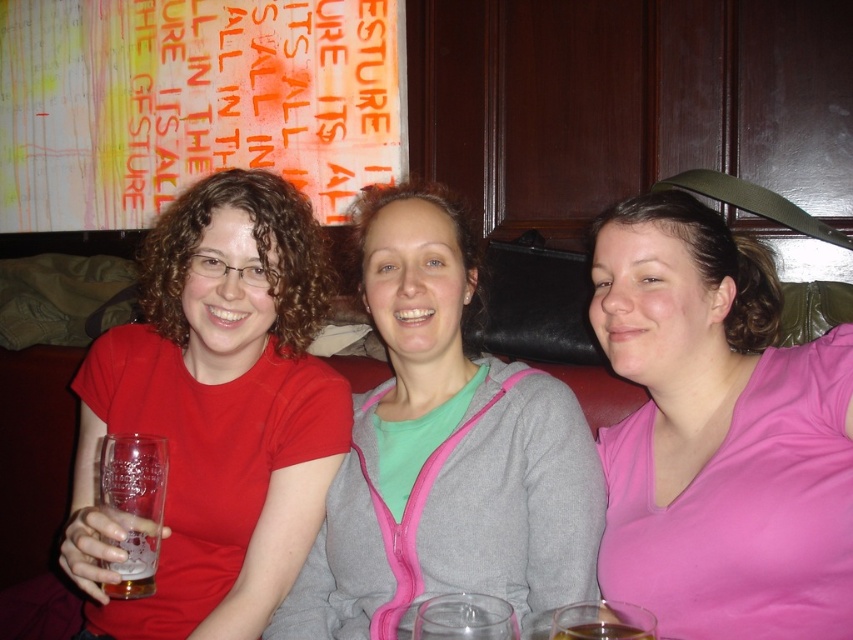
You are a photographer trying to capture a candid shot of the pink matte shirt at center and the clear glass beer at left. Since you want to focus on the shirt, which object should you prioritize keeping in the foreground?

The pink matte shirt at center is closer to the viewer than the clear glass beer at left, so you should prioritize keeping the pink matte shirt at center in the foreground to ensure it remains the main focus of the photo.